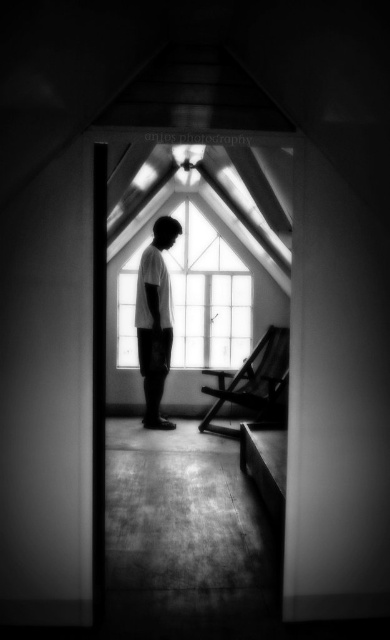
Question: Is transparent glass window at center wider than white matte shirt at center?

Choices:
 (A) no
 (B) yes

Answer: (B)

Question: Which object appears farthest from the camera in this image?

Choices:
 (A) transparent glass window at center
 (B) white matte shirt at center

Answer: (A)

Question: Which point is closer to the camera?

Choices:
 (A) (159, 280)
 (B) (207, 301)

Answer: (A)

Question: Is transparent glass window at center to the left of white matte shirt at center from the viewer's perspective?

Choices:
 (A) yes
 (B) no

Answer: (B)

Question: Does transparent glass window at center appear over white matte shirt at center?

Choices:
 (A) yes
 (B) no

Answer: (A)

Question: Which point is closer to the camera?

Choices:
 (A) transparent glass window at center
 (B) white matte shirt at center

Answer: (B)